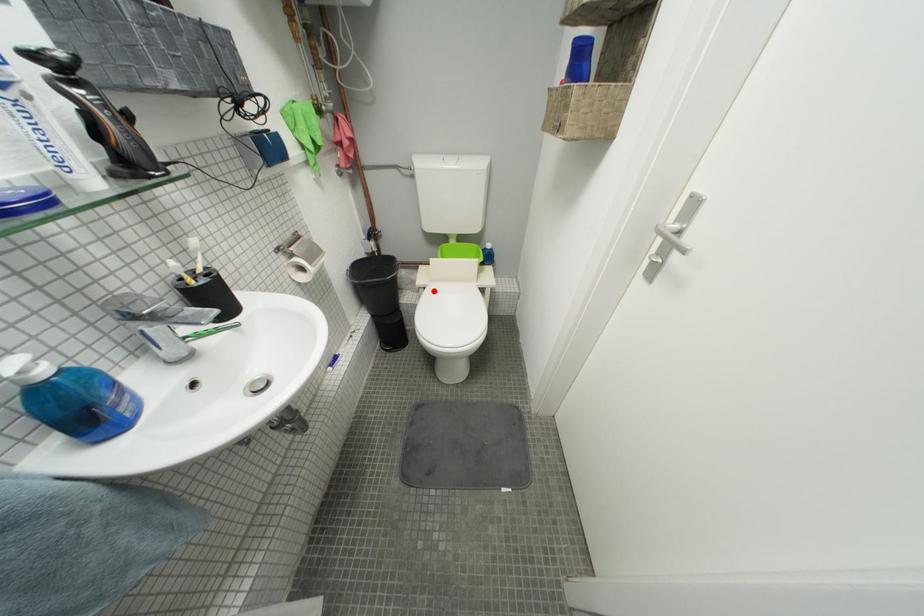
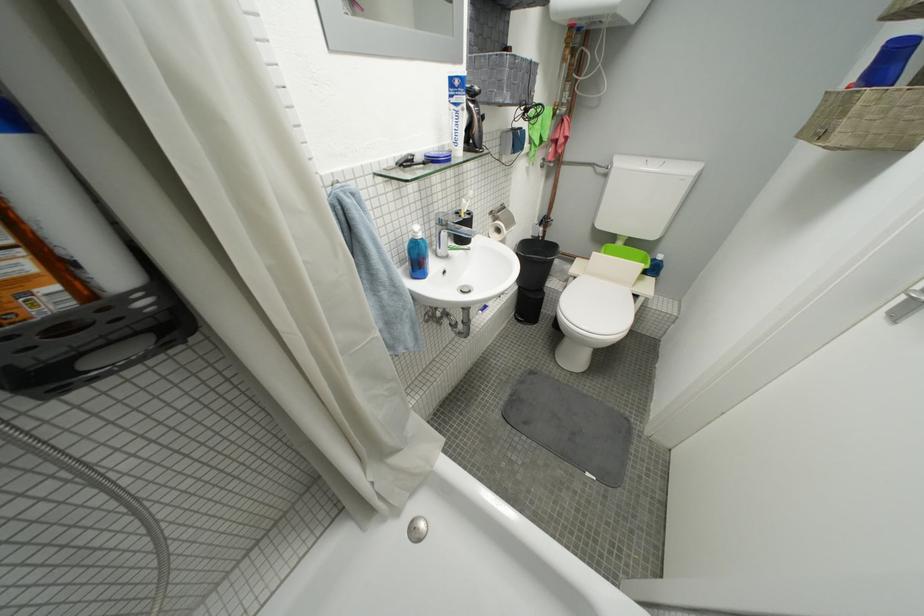
Question: I am providing you with two images of the same scene from different viewpoints. Given a red point in image1, look at the same physical point in image2. Is it:

Choices:
 (A) Closer to the viewpoint
 (B) Farther from the viewpoint

Answer: (A)